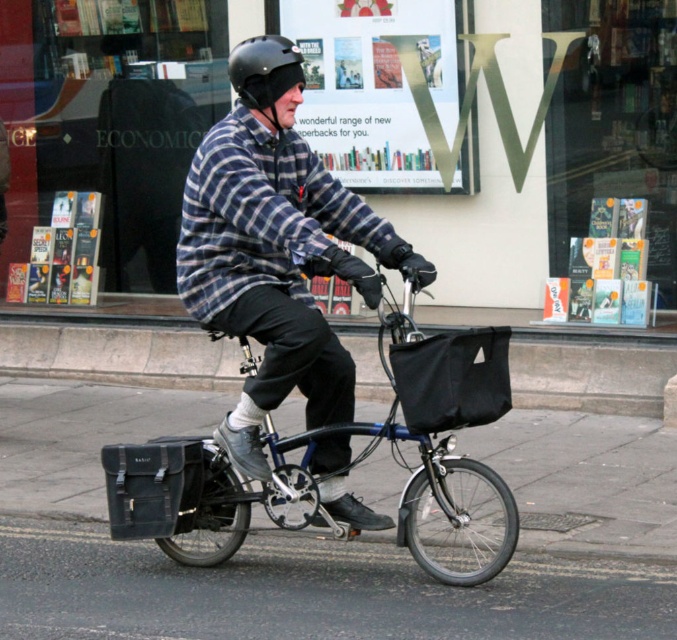
Question: Is metallic blue bicycle at center positioned before black matte helmet at center?

Choices:
 (A) no
 (B) yes

Answer: (B)

Question: Which point appears farthest from the camera in this image?

Choices:
 (A) (215, 490)
 (B) (253, 49)
 (C) (257, 330)

Answer: (A)

Question: Does plaid flannel shirt at center have a larger size compared to metallic blue bicycle at center?

Choices:
 (A) no
 (B) yes

Answer: (A)

Question: Which point is farther to the camera?

Choices:
 (A) plaid flannel shirt at center
 (B) metallic blue bicycle at center

Answer: (A)

Question: Can you confirm if plaid flannel shirt at center is wider than metallic blue bicycle at center?

Choices:
 (A) no
 (B) yes

Answer: (A)

Question: Considering the real-world distances, which object is closest to the black matte helmet at center?

Choices:
 (A) plaid flannel shirt at center
 (B) metallic blue bicycle at center

Answer: (A)